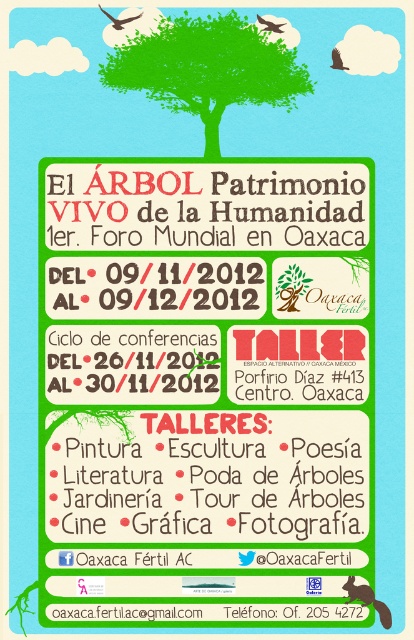
Which is behind, point (262, 509) or point (226, 70)?

The point (262, 509) is more distant.

Is matte red text at center wider than green matte tree at upper center?

Correct, the width of matte red text at center exceeds that of green matte tree at upper center.

Where is `matte red text at center`? matte red text at center is located at coordinates (211, 477).